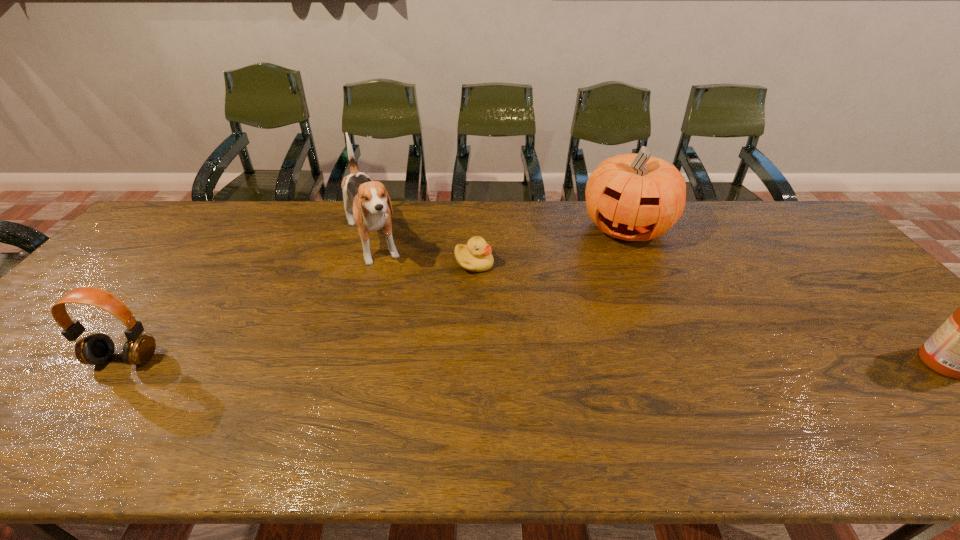
The width and height of the screenshot is (960, 540). Find the location of `the fourth tallest object`. the fourth tallest object is located at coordinates (97, 349).

Where is `the leftmost object`? The image size is (960, 540). the leftmost object is located at coordinates pyautogui.click(x=97, y=349).

This screenshot has width=960, height=540. Find the location of `the shortest object`. the shortest object is located at coordinates (476, 256).

I want to click on the third object from right to left, so click(x=476, y=256).

Find the location of a particular element. Image resolution: width=960 pixels, height=540 pixels. pumpkin is located at coordinates (635, 197).

Find the location of a particular element. This screenshot has width=960, height=540. the second object from left to right is located at coordinates click(368, 198).

I want to click on vacant region located on the ear cups of the headset, so click(92, 402).

Find the location of a particular element. Image resolution: width=960 pixels, height=540 pixels. vacant point located on the front-facing side of the duckling is located at coordinates (509, 301).

Locate an element on the screen. The height and width of the screenshot is (540, 960). free space located 0.080m on the front-facing side of the duckling is located at coordinates (499, 290).

Locate an element on the screen. blank space located on the front-facing side of the duckling is located at coordinates (560, 356).